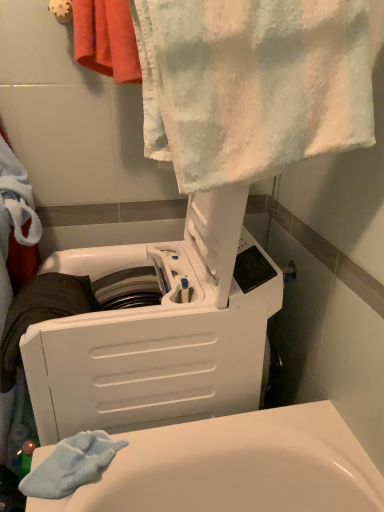
Question: Is red cotton towel at upper left, which is the 2th towel from front to back, shorter than white plastic washing machine at upper center?

Choices:
 (A) no
 (B) yes

Answer: (B)

Question: Are red cotton towel at upper left, marked as the 1th towel in a back-to-front arrangement, and white plastic washing machine at upper center far apart?

Choices:
 (A) yes
 (B) no

Answer: (B)

Question: Is red cotton towel at upper left, marked as the 1th towel in a back-to-front arrangement, at the left side of white plastic washing machine at upper center?

Choices:
 (A) yes
 (B) no

Answer: (B)

Question: Is red cotton towel at upper left, which is the 2th towel from front to back, taller than white plastic washing machine at upper center?

Choices:
 (A) yes
 (B) no

Answer: (B)

Question: Does red cotton towel at upper left, which is the 2th towel from front to back, lie in front of white plastic washing machine at upper center?

Choices:
 (A) yes
 (B) no

Answer: (B)

Question: Is red cotton towel at upper left, which is the 2th towel from front to back, surrounding white plastic washing machine at upper center?

Choices:
 (A) no
 (B) yes

Answer: (A)

Question: Can you confirm if white plastic washing machine at upper center is taller than red cotton towel at upper left, which is the 2th towel from front to back?

Choices:
 (A) yes
 (B) no

Answer: (A)

Question: Is white plastic washing machine at upper center smaller than red cotton towel at upper left, marked as the 1th towel in a back-to-front arrangement?

Choices:
 (A) no
 (B) yes

Answer: (A)

Question: From a real-world perspective, is white plastic washing machine at upper center positioned over red cotton towel at upper left, marked as the 1th towel in a back-to-front arrangement, based on gravity?

Choices:
 (A) no
 (B) yes

Answer: (A)

Question: Is white plastic washing machine at upper center behind red cotton towel at upper left, which is the 2th towel from front to back?

Choices:
 (A) yes
 (B) no

Answer: (B)

Question: Is white plastic washing machine at upper center located outside red cotton towel at upper left, marked as the 1th towel in a back-to-front arrangement?

Choices:
 (A) yes
 (B) no

Answer: (A)

Question: Are white plastic washing machine at upper center and red cotton towel at upper left, which is the 2th towel from front to back, beside each other?

Choices:
 (A) yes
 (B) no

Answer: (B)

Question: From a real-world perspective, does white textured towel at upper center, which is the second towel from back to front, sit lower than white plastic washing machine at upper center?

Choices:
 (A) yes
 (B) no

Answer: (B)